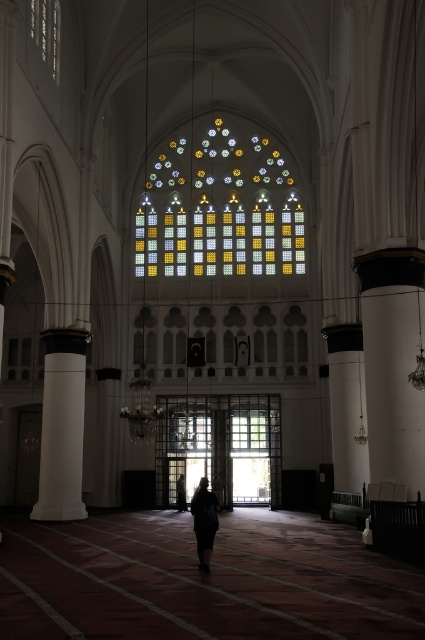
How distant is clear glass door at center from dark clothing figure at center?

The distance of clear glass door at center from dark clothing figure at center is 23.81 feet.

Can you confirm if clear glass door at center is wider than dark clothing figure at center?

Yes.

I want to click on clear glass door at center, so click(x=221, y=445).

Does clear glass door at center appear on the left side of black polished pillar at right?

Yes, clear glass door at center is to the left of black polished pillar at right.

Does clear glass door at center appear under black polished pillar at right?

Yes.

Which is behind, point (164, 396) or point (329, 353)?

Positioned behind is point (164, 396).

Find the location of a particular element. The height and width of the screenshot is (640, 425). clear glass door at center is located at coordinates (221, 445).

In the scene shown: Can you confirm if black polished pillar at right is positioned to the left of dark clothing figure at center?

In fact, black polished pillar at right is to the right of dark clothing figure at center.

Which of these two, black polished pillar at right or dark clothing figure at center, stands shorter?

With less height is dark clothing figure at center.

What do you see at coordinates (346, 404) in the screenshot?
I see `black polished pillar at right` at bounding box center [346, 404].

This screenshot has width=425, height=640. I want to click on black polished pillar at right, so click(x=346, y=404).